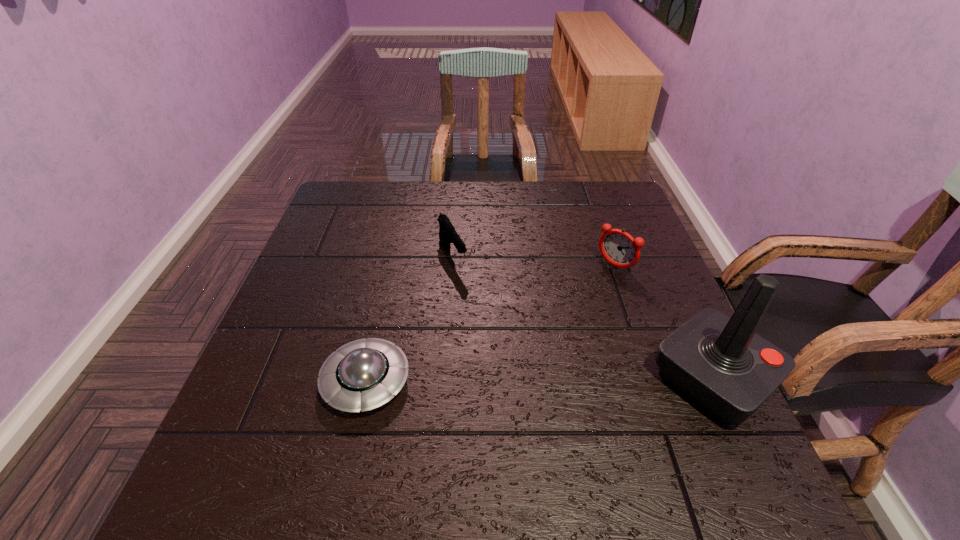
What are the coordinates of `the leftmost object` in the screenshot? It's located at (364, 374).

In order to click on saucer in this screenshot , I will do `click(364, 374)`.

This screenshot has width=960, height=540. What are the coordinates of `joystick` in the screenshot? It's located at (719, 362).

What are the coordinates of `alarm clock` in the screenshot? It's located at (617, 247).

Find the location of a particular element. the second object from left to right is located at coordinates (447, 234).

The image size is (960, 540). What are the coordinates of `the second shortest object` in the screenshot? It's located at (447, 234).

At what (x,y) coordinates should I click in order to perform the action: click on vacant space located on the left of the saucer. Please return your answer as a coordinate pair (x, y). This screenshot has width=960, height=540. Looking at the image, I should click on (281, 381).

Where is `vacant space located on the back of the tallest object`? Image resolution: width=960 pixels, height=540 pixels. vacant space located on the back of the tallest object is located at coordinates (682, 312).

Locate an element on the screen. This screenshot has height=540, width=960. vacant space located on the front-facing side of the alarm clock is located at coordinates (590, 289).

In order to click on free space located 0.070m on the front-facing side of the alarm clock in this screenshot , I will do `click(590, 289)`.